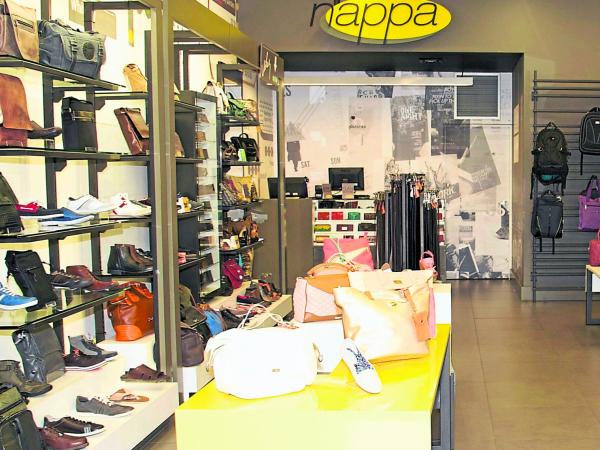
Identify the location of yellow counter. The height and width of the screenshot is (450, 600). (395, 377).